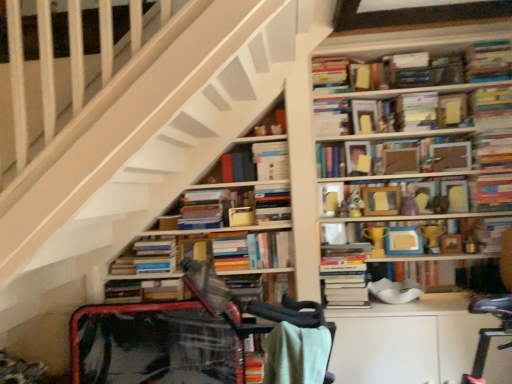
Image resolution: width=512 pixels, height=384 pixels. What are the coordinates of `free space above wooden frame at upper center, positioned as the thirteenth book in bottom-to-top order (from a real-world perspective)` in the screenshot? It's located at (419, 139).